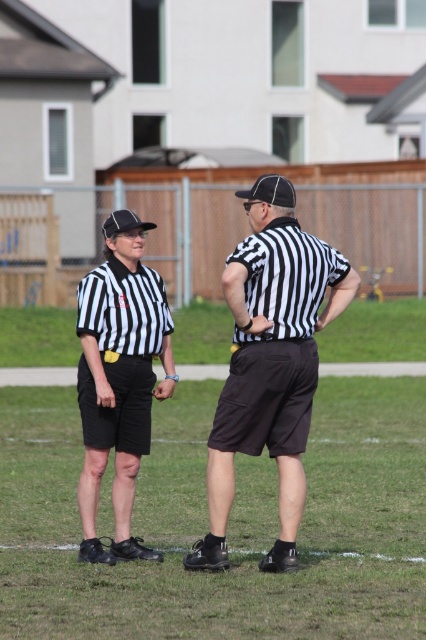
Question: Which of the following is the farthest from the observer?

Choices:
 (A) (278, 368)
 (B) (134, 216)

Answer: (B)

Question: Is the position of black striped shirt at right more distant than that of matte black referee shirt at left?

Choices:
 (A) yes
 (B) no

Answer: (B)

Question: Can you confirm if black striped shirt at right is positioned to the right of matte black referee shirt at left?

Choices:
 (A) yes
 (B) no

Answer: (A)

Question: Is black striped shirt at right thinner than matte black referee shirt at left?

Choices:
 (A) yes
 (B) no

Answer: (B)